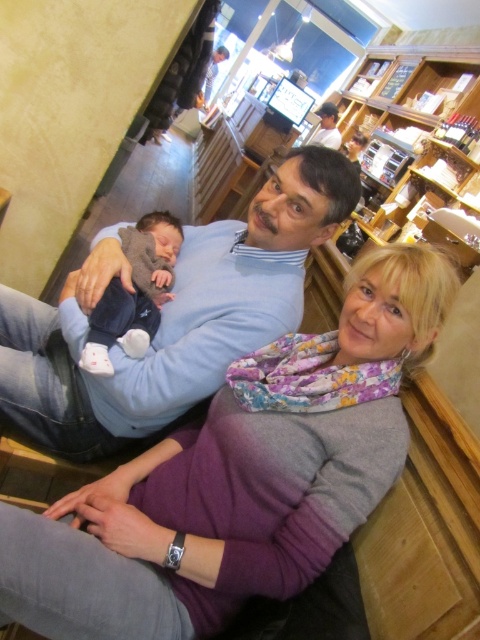
You are a customer in the cafe and want to see the purple fabric scarf at center that is currently covering part of the matte blue sweater at center. Can you adjust the scarf to view the sweater underneath?

The purple fabric scarf at center is in front of the matte blue sweater at center, so you can move the scarf to see the sweater underneath.

You are a customer in the cafe and you want to place your small bag on the purple fabric scarf at center. Can you estimate the exact coordinates where you should place it?

The purple fabric scarf at center is located at coordinates point (x=239, y=477), so you should place your bag there.